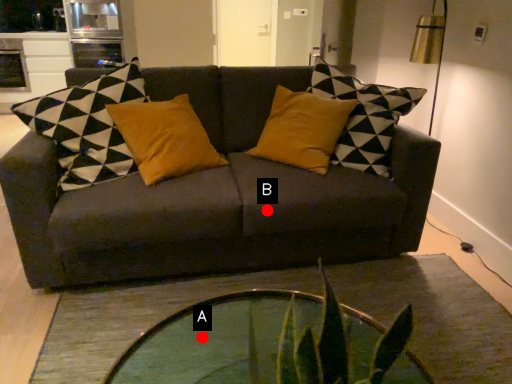
Question: Two points are circled on the image, labeled by A and B beside each circle. Which point is farther from the camera taking this photo?

Choices:
 (A) A is further
 (B) B is further

Answer: (B)